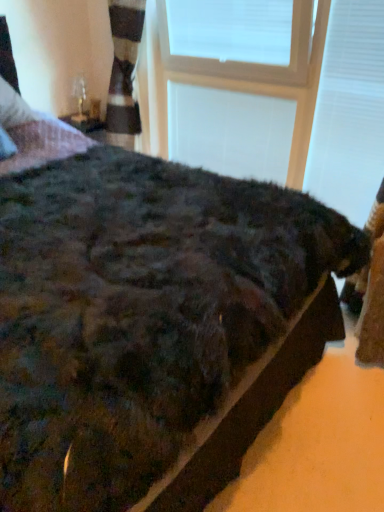
Question: Is white plastic window frame at upper center, which appears as the 1th window frame when viewed from the back, bigger than white plastic window frame at upper center, acting as the second window frame starting from the back?

Choices:
 (A) yes
 (B) no

Answer: (B)

Question: Is the position of white plastic window frame at upper center, acting as the second window frame starting from the front, less distant than that of white plastic window frame at upper center, the 1th window frame from the front?

Choices:
 (A) yes
 (B) no

Answer: (B)

Question: Is white plastic window frame at upper center, which appears as the 1th window frame when viewed from the back, wider than white plastic window frame at upper center, acting as the second window frame starting from the back?

Choices:
 (A) no
 (B) yes

Answer: (A)

Question: Is white plastic window frame at upper center, which appears as the 1th window frame when viewed from the back, facing away from white plastic window frame at upper center, the 1th window frame from the front?

Choices:
 (A) yes
 (B) no

Answer: (A)

Question: From a real-world perspective, is white plastic window frame at upper center, which appears as the 1th window frame when viewed from the back, positioned over white plastic window frame at upper center, the 1th window frame from the front, based on gravity?

Choices:
 (A) yes
 (B) no

Answer: (B)

Question: Is point (79, 118) positioned closer to the camera than point (182, 57)?

Choices:
 (A) farther
 (B) closer

Answer: (A)

Question: From their relative heights in the image, would you say clear glass table lamp at upper left is taller or shorter than white plastic window frame at upper center, acting as the second window frame starting from the back?

Choices:
 (A) tall
 (B) short

Answer: (B)

Question: Is clear glass table lamp at upper left in front of or behind white plastic window frame at upper center, acting as the second window frame starting from the back, in the image?

Choices:
 (A) front
 (B) behind

Answer: (B)

Question: Looking at the image, does clear glass table lamp at upper left seem bigger or smaller compared to white plastic window frame at upper center, the 1th window frame from the front?

Choices:
 (A) small
 (B) big

Answer: (A)

Question: In terms of size, does white plastic window frame at upper center, acting as the second window frame starting from the back, appear bigger or smaller than clear glass table lamp at upper left?

Choices:
 (A) small
 (B) big

Answer: (B)

Question: From a real-world perspective, relative to clear glass table lamp at upper left, is white plastic window frame at upper center, the 1th window frame from the front, vertically above or below?

Choices:
 (A) above
 (B) below

Answer: (A)

Question: Is white plastic window frame at upper center, the 1th window frame from the front, in front of or behind clear glass table lamp at upper left in the image?

Choices:
 (A) behind
 (B) front

Answer: (B)

Question: In the image, is white plastic window frame at upper center, the 1th window frame from the front, on the left side or the right side of clear glass table lamp at upper left?

Choices:
 (A) right
 (B) left

Answer: (A)

Question: Which is correct: clear glass table lamp at upper left is inside white plastic window frame at upper center, acting as the second window frame starting from the front, or outside of it?

Choices:
 (A) inside
 (B) outside

Answer: (B)

Question: From the image's perspective, is clear glass table lamp at upper left above or below white plastic window frame at upper center, which appears as the 1th window frame when viewed from the back?

Choices:
 (A) below
 (B) above

Answer: (B)